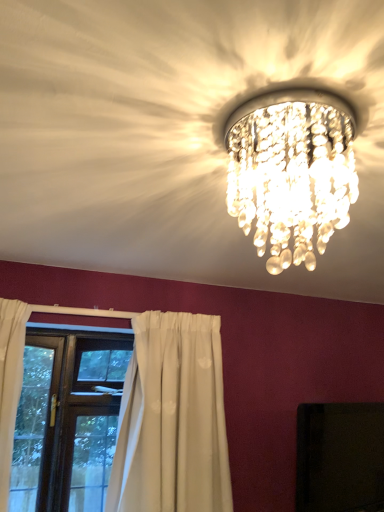
Question: Are black glossy tv at upper center and brown wooden window at lower left making contact?

Choices:
 (A) yes
 (B) no

Answer: (B)

Question: Is black glossy tv at upper center positioned far away from brown wooden window at lower left?

Choices:
 (A) yes
 (B) no

Answer: (A)

Question: From the image's perspective, is black glossy tv at upper center located above brown wooden window at lower left?

Choices:
 (A) yes
 (B) no

Answer: (B)

Question: From a real-world perspective, is black glossy tv at upper center beneath brown wooden window at lower left?

Choices:
 (A) yes
 (B) no

Answer: (A)

Question: Does black glossy tv at upper center have a larger size compared to brown wooden window at lower left?

Choices:
 (A) yes
 (B) no

Answer: (B)

Question: In the image, is brown wooden window at lower left on the left side or the right side of clear crystal chandelier at upper center?

Choices:
 (A) right
 (B) left

Answer: (B)

Question: From the image's perspective, is brown wooden window at lower left positioned above or below clear crystal chandelier at upper center?

Choices:
 (A) above
 (B) below

Answer: (B)

Question: Considering the positions of brown wooden window at lower left and clear crystal chandelier at upper center in the image, is brown wooden window at lower left taller or shorter than clear crystal chandelier at upper center?

Choices:
 (A) tall
 (B) short

Answer: (A)

Question: Considering the positions of brown wooden window at lower left and clear crystal chandelier at upper center in the image, is brown wooden window at lower left wider or thinner than clear crystal chandelier at upper center?

Choices:
 (A) thin
 (B) wide

Answer: (A)

Question: Is clear crystal chandelier at upper center inside or outside of black glossy tv at upper center?

Choices:
 (A) outside
 (B) inside

Answer: (A)

Question: Would you say clear crystal chandelier at upper center is to the left or to the right of black glossy tv at upper center in the picture?

Choices:
 (A) left
 (B) right

Answer: (A)

Question: From the image's perspective, is clear crystal chandelier at upper center positioned above or below black glossy tv at upper center?

Choices:
 (A) above
 (B) below

Answer: (A)

Question: Does point (251, 106) appear closer or farther from the camera than point (329, 434)?

Choices:
 (A) closer
 (B) farther

Answer: (A)

Question: From the image's perspective, is clear crystal chandelier at upper center above or below brown wooden window at lower left?

Choices:
 (A) above
 (B) below

Answer: (A)

Question: Based on their positions, is clear crystal chandelier at upper center located to the left or right of brown wooden window at lower left?

Choices:
 (A) left
 (B) right

Answer: (B)